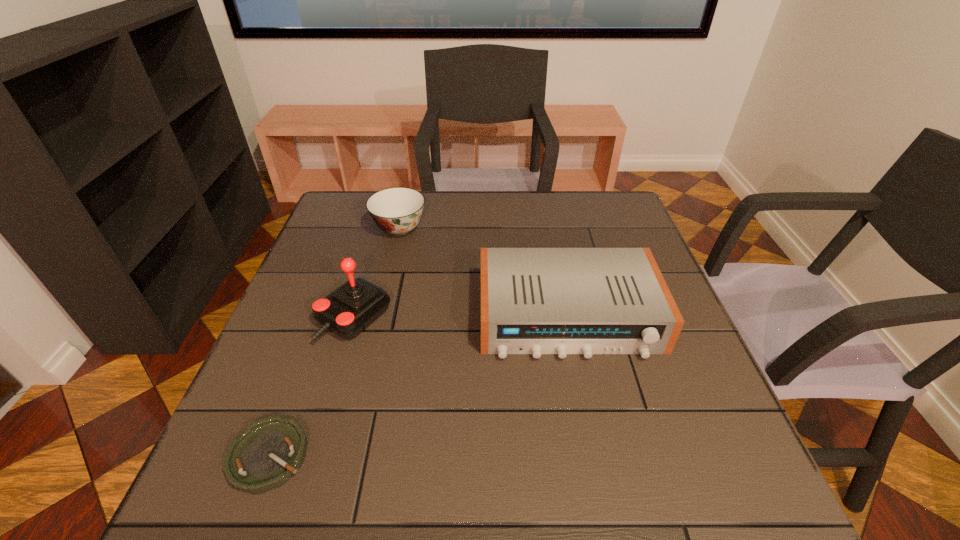
The height and width of the screenshot is (540, 960). In order to click on object that is the second closest one to the radio receiver in this screenshot , I will do `click(397, 211)`.

Select which object is the closest to the radio receiver. Please provide its 2D coordinates. Your answer should be formatted as a tuple, i.e. [(x, y)], where the tuple contains the x and y coordinates of a point satisfying the conditions above.

[(351, 308)]